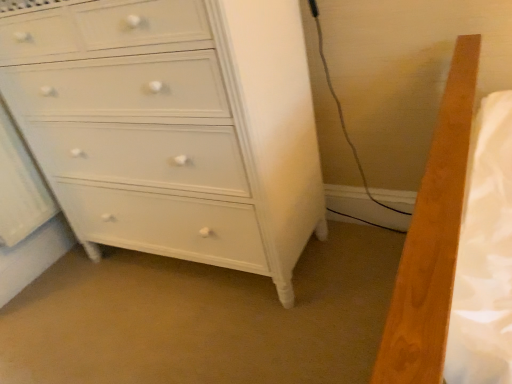
Locate an element on the screen. This screenshot has width=512, height=384. white painted wood chest of drawers at left is located at coordinates (173, 126).

This screenshot has width=512, height=384. Describe the element at coordinates (173, 126) in the screenshot. I see `white painted wood chest of drawers at left` at that location.

Locate an element on the screen. white painted wood chest of drawers at left is located at coordinates (173, 126).